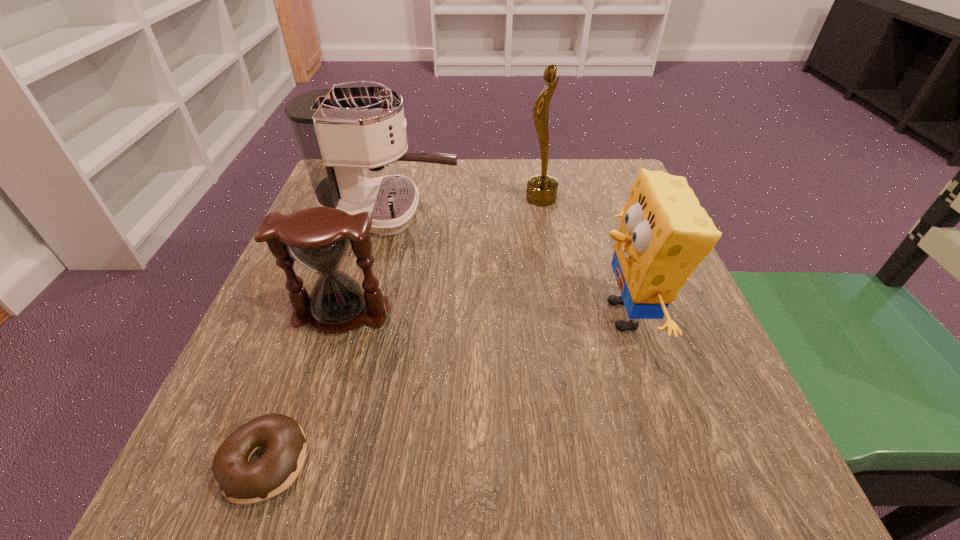
Select which object appears as the third closest to the coffee maker. Please provide its 2D coordinates. Your answer should be formatted as a tuple, i.e. [(x, y)], where the tuple contains the x and y coordinates of a point satisfying the conditions above.

[(664, 234)]

Locate an element on the screen. This screenshot has width=960, height=540. vacant space that satisfies the following two spatial constraints: 1. on the front-facing side of the coffee maker; 2. on the front side of the fourth tallest object is located at coordinates (362, 314).

The width and height of the screenshot is (960, 540). Find the location of `free space that satisfies the following two spatial constraints: 1. on the front-facing side of the coffee maker; 2. on the front side of the nearest object`. free space that satisfies the following two spatial constraints: 1. on the front-facing side of the coffee maker; 2. on the front side of the nearest object is located at coordinates tap(324, 462).

Locate an element on the screen. The width and height of the screenshot is (960, 540). free location that satisfies the following two spatial constraints: 1. on the front-facing side of the award; 2. on the front side of the nearest object is located at coordinates (x=589, y=462).